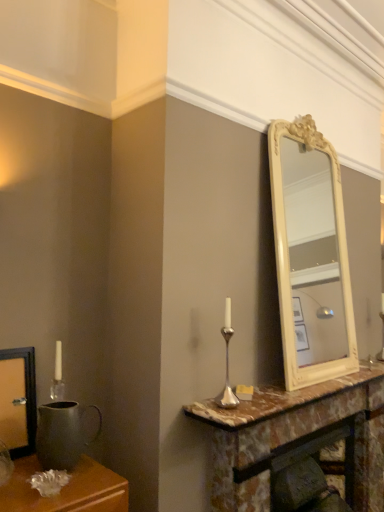
Question: Would you say matte metal pitcher at left is a long distance from marble at center?

Choices:
 (A) yes
 (B) no

Answer: (B)

Question: Is matte metal pitcher at left behind marble at center?

Choices:
 (A) no
 (B) yes

Answer: (A)

Question: Could you tell me if matte metal pitcher at left is facing marble at center?

Choices:
 (A) yes
 (B) no

Answer: (B)

Question: From a real-world perspective, is matte metal pitcher at left under marble at center?

Choices:
 (A) yes
 (B) no

Answer: (A)

Question: Is matte metal pitcher at left turned away from marble at center?

Choices:
 (A) yes
 (B) no

Answer: (B)

Question: Considering the positions of marble at center and silver metallic candle holder at center in the image, is marble at center taller or shorter than silver metallic candle holder at center?

Choices:
 (A) short
 (B) tall

Answer: (A)

Question: From the image's perspective, is marble at center located above or below silver metallic candle holder at center?

Choices:
 (A) above
 (B) below

Answer: (B)

Question: Considering the positions of marble at center and silver metallic candle holder at center in the image, is marble at center wider or thinner than silver metallic candle holder at center?

Choices:
 (A) thin
 (B) wide

Answer: (B)

Question: Is marble at center in front of or behind silver metallic candle holder at center in the image?

Choices:
 (A) behind
 (B) front

Answer: (B)

Question: In terms of width, does marble at center look wider or thinner when compared to matte metal pitcher at left?

Choices:
 (A) wide
 (B) thin

Answer: (A)

Question: Is point (276, 387) positioned closer to the camera than point (67, 449)?

Choices:
 (A) closer
 (B) farther

Answer: (B)

Question: From the image's perspective, is marble at center positioned above or below matte metal pitcher at left?

Choices:
 (A) above
 (B) below

Answer: (B)

Question: In terms of size, does marble at center appear bigger or smaller than matte metal pitcher at left?

Choices:
 (A) small
 (B) big

Answer: (B)

Question: Is point (49, 466) positioned closer to the camera than point (233, 401)?

Choices:
 (A) closer
 (B) farther

Answer: (A)

Question: Is matte metal pitcher at left bigger or smaller than silver metallic candle holder at center?

Choices:
 (A) small
 (B) big

Answer: (B)